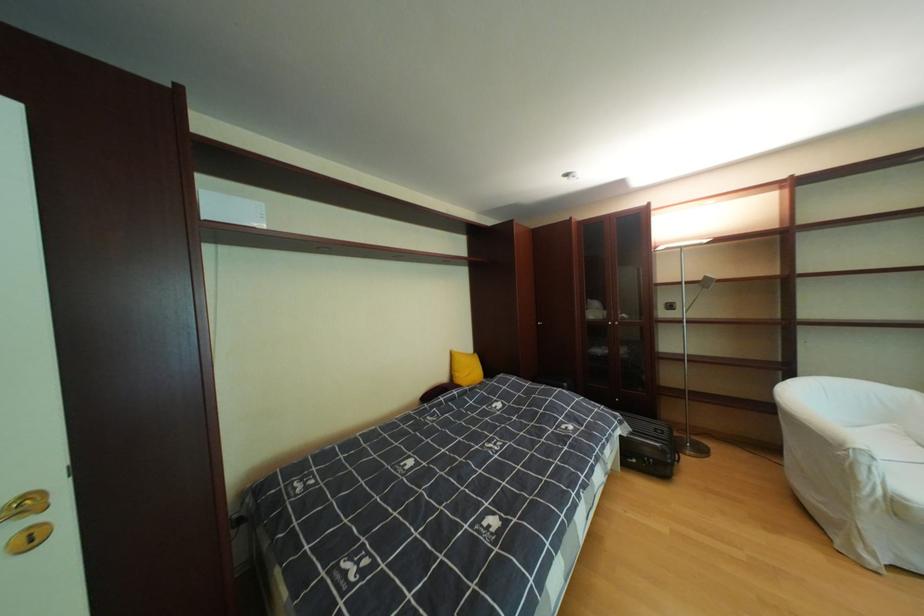
At what (x,y) coordinates should I click in order to perform the action: click on sofa sitting surface. Please return your answer as a coordinate pair (x, y). The height and width of the screenshot is (616, 924). Looking at the image, I should click on (896, 468).